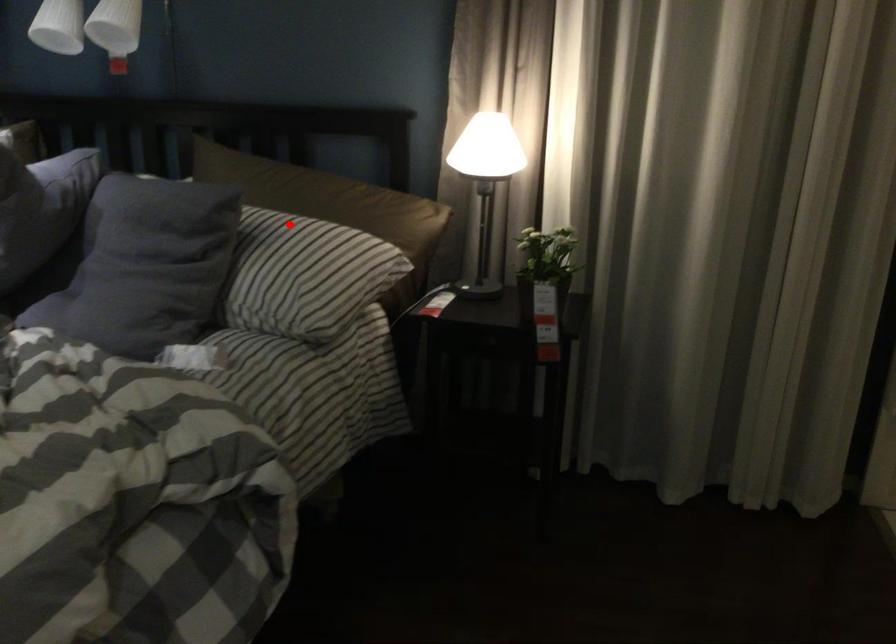
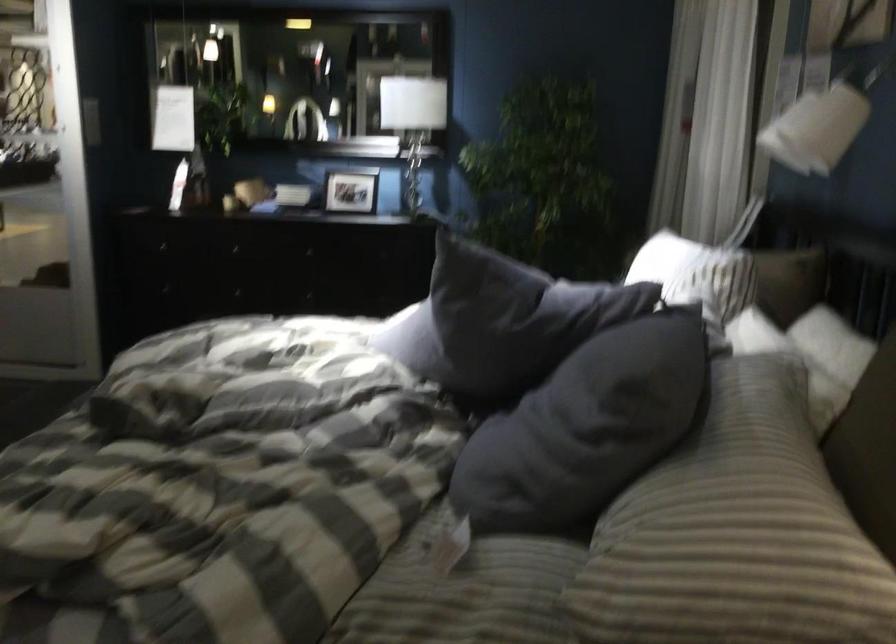
In the second image, find the point that corresponds to the highlighted location in the first image.

(760, 453)